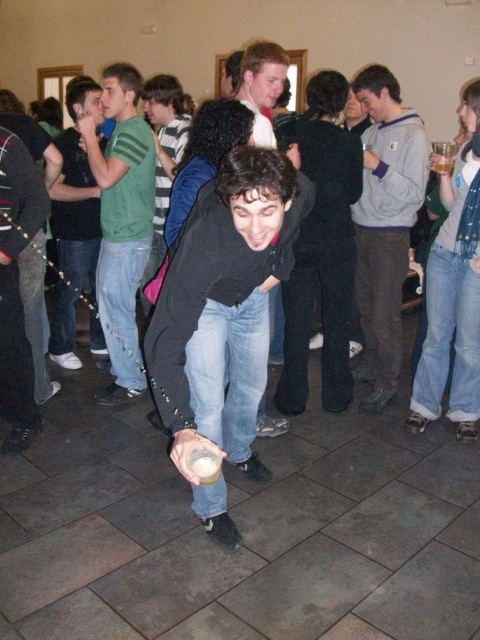
You are at a party and want to hand a drink to the person wearing the gray fleece sweater at center and the matte black shirt at upper left. Which one can you reach more easily if you are standing directly in front of both?

The matte black shirt at upper left can be reached more easily because it is shorter than the gray fleece sweater at center.

You are at a party and want to hand a drink to both the gray fleece sweater at center and the green striped shirt at upper left. Which person should you approach first to ensure you can reach them without moving too far?

You should approach the gray fleece sweater at center first because it is closer to you than the green striped shirt at upper left, which is further away.